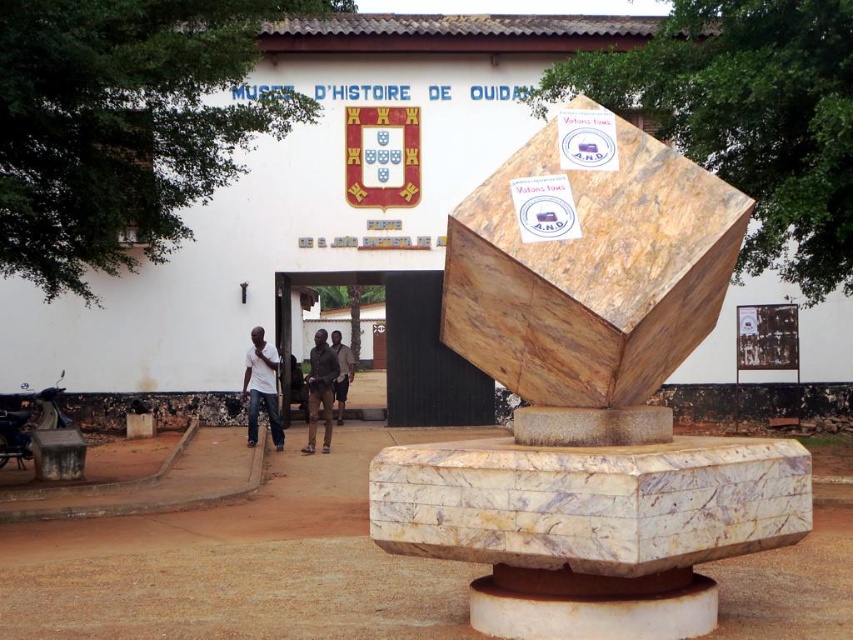
Question: Is brown leather jacket at center above dark brown leather pants at center?

Choices:
 (A) yes
 (B) no

Answer: (B)

Question: Among these points, which one is nearest to the camera?

Choices:
 (A) (340, 396)
 (B) (317, 416)
 (C) (525, 289)
 (D) (253, 348)

Answer: (C)

Question: Considering the real-world distances, which object is closest to the dark brown leather pants at center?

Choices:
 (A) white matte shirt at left
 (B) brown leather jacket at center

Answer: (B)

Question: Can you confirm if brown leather jacket at center is smaller than dark brown leather pants at center?

Choices:
 (A) no
 (B) yes

Answer: (A)

Question: Which point is closer to the camera?

Choices:
 (A) marble sculpture at center
 (B) white matte shirt at left

Answer: (A)

Question: Can you confirm if marble sculpture at center is thinner than brown leather jacket at center?

Choices:
 (A) yes
 (B) no

Answer: (A)